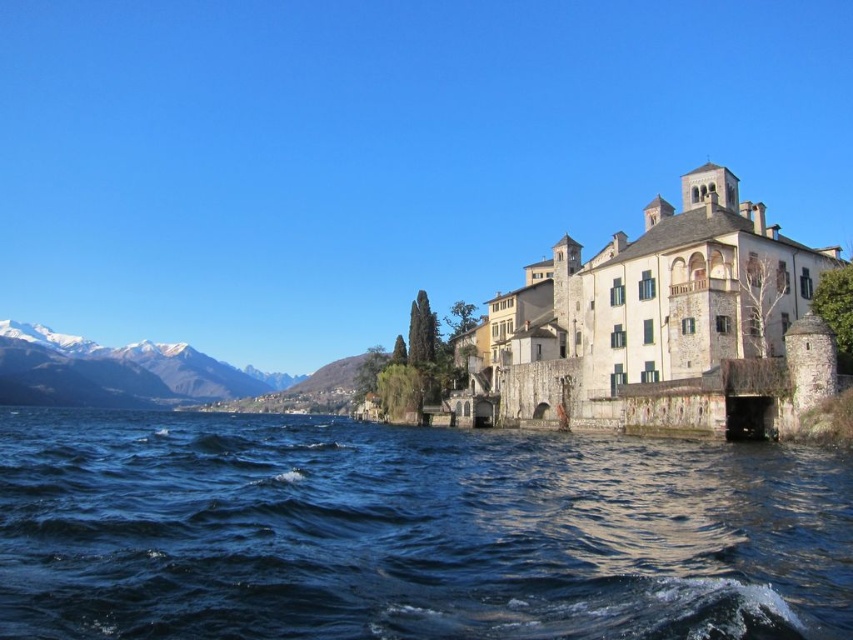
Between dark blue water at lower left and snowy white mountain at left, which one is positioned higher?

dark blue water at lower left

Can you confirm if dark blue water at lower left is bigger than snowy white mountain at left?

No.

Where is `dark blue water at lower left`? This screenshot has width=853, height=640. dark blue water at lower left is located at coordinates (409, 532).

Identify the location of dark blue water at lower left. (409, 532).